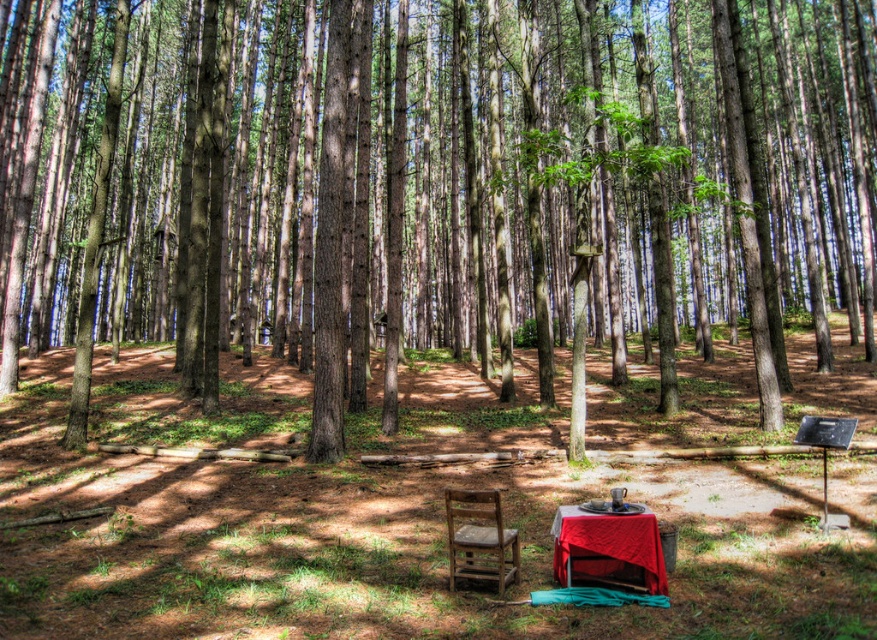
What is the 2D coordinate of the brown wood tree at center in the image?

The brown wood tree at center is located at the 2D coordinate point of (436,188).